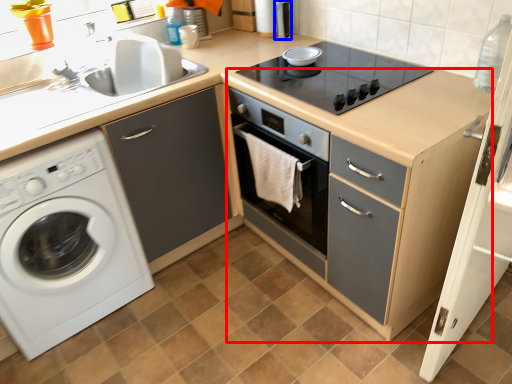
Question: Which object appears farthest to the camera in this image, file cabinet (highlighted by a red box) or appliance (highlighted by a blue box)?

Choices:
 (A) file cabinet
 (B) appliance

Answer: (B)